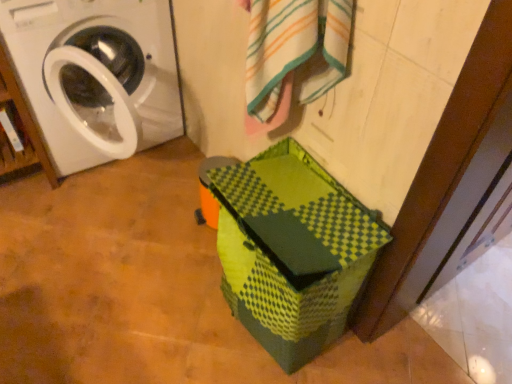
Question: Can you confirm if white striped bath towel at upper center is smaller than green matte cardboard box at lower center?

Choices:
 (A) yes
 (B) no

Answer: (A)

Question: Would you consider white striped bath towel at upper center to be distant from green matte cardboard box at lower center?

Choices:
 (A) no
 (B) yes

Answer: (A)

Question: Can you confirm if white striped bath towel at upper center is positioned to the left of green matte cardboard box at lower center?

Choices:
 (A) yes
 (B) no

Answer: (B)

Question: Could green matte cardboard box at lower center be considered to be inside white striped bath towel at upper center?

Choices:
 (A) yes
 (B) no

Answer: (B)

Question: From the image's perspective, is white striped bath towel at upper center located beneath green matte cardboard box at lower center?

Choices:
 (A) no
 (B) yes

Answer: (A)

Question: Is white striped bath towel at upper center taller or shorter than green matte cardboard box at lower center?

Choices:
 (A) short
 (B) tall

Answer: (A)

Question: From the image's perspective, is white striped bath towel at upper center above or below green matte cardboard box at lower center?

Choices:
 (A) above
 (B) below

Answer: (A)

Question: Does point (320, 54) appear closer or farther from the camera than point (335, 271)?

Choices:
 (A) farther
 (B) closer

Answer: (A)

Question: In terms of width, does white striped bath towel at upper center look wider or thinner when compared to green matte cardboard box at lower center?

Choices:
 (A) thin
 (B) wide

Answer: (A)

Question: Considering the positions of white striped bath towel at upper center and white glossy washing machine at left in the image, is white striped bath towel at upper center wider or thinner than white glossy washing machine at left?

Choices:
 (A) thin
 (B) wide

Answer: (A)

Question: In the image, is white striped bath towel at upper center on the left side or the right side of white glossy washing machine at left?

Choices:
 (A) right
 (B) left

Answer: (A)

Question: From the image's perspective, is white striped bath towel at upper center above or below white glossy washing machine at left?

Choices:
 (A) above
 (B) below

Answer: (B)

Question: In terms of height, does white striped bath towel at upper center look taller or shorter compared to white glossy washing machine at left?

Choices:
 (A) tall
 (B) short

Answer: (B)

Question: Visually, is white glossy washing machine at left positioned to the left or to the right of green matte cardboard box at lower center?

Choices:
 (A) right
 (B) left

Answer: (B)

Question: Considering their positions, is white glossy washing machine at left located in front of or behind green matte cardboard box at lower center?

Choices:
 (A) behind
 (B) front

Answer: (A)